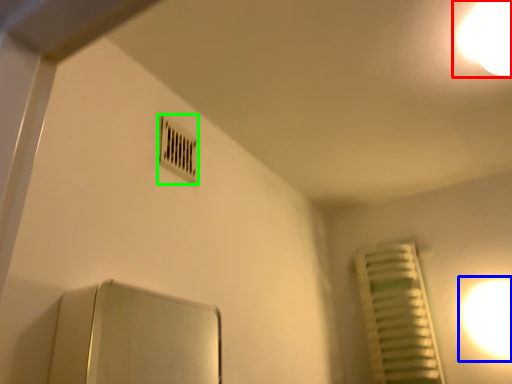
Question: Based on their relative distances, which object is farther from light (highlighted by a red box)? Choose from light (highlighted by a blue box) and air conditioning (highlighted by a green box).

Choices:
 (A) light
 (B) air conditioning

Answer: (A)